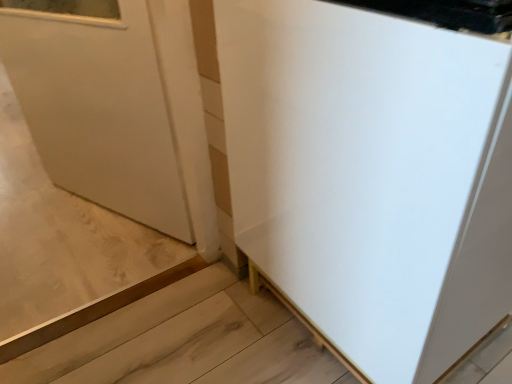
The height and width of the screenshot is (384, 512). I want to click on white matte cabinet at center, so click(372, 176).

Describe the element at coordinates (372, 176) in the screenshot. This screenshot has width=512, height=384. I see `white matte cabinet at center` at that location.

Image resolution: width=512 pixels, height=384 pixels. I want to click on white matte cabinet at center, so click(372, 176).